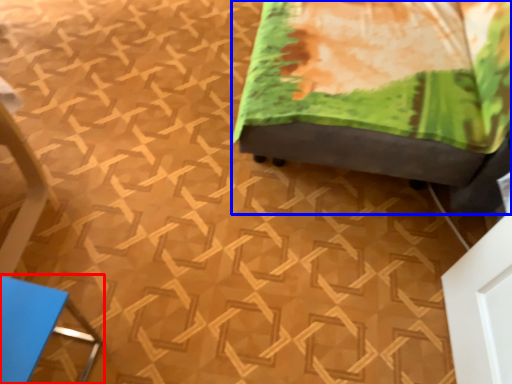
Question: Which object appears closest to the camera in this image, furniture (highlighted by a red box) or furniture (highlighted by a blue box)?

Choices:
 (A) furniture
 (B) furniture

Answer: (A)